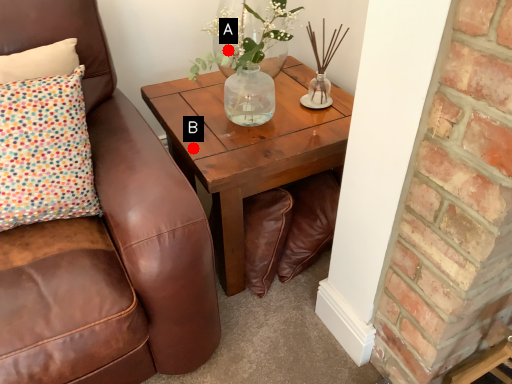
Question: Two points are circled on the image, labeled by A and B beside each circle. Which point is further to the camera?

Choices:
 (A) A is further
 (B) B is further

Answer: (A)